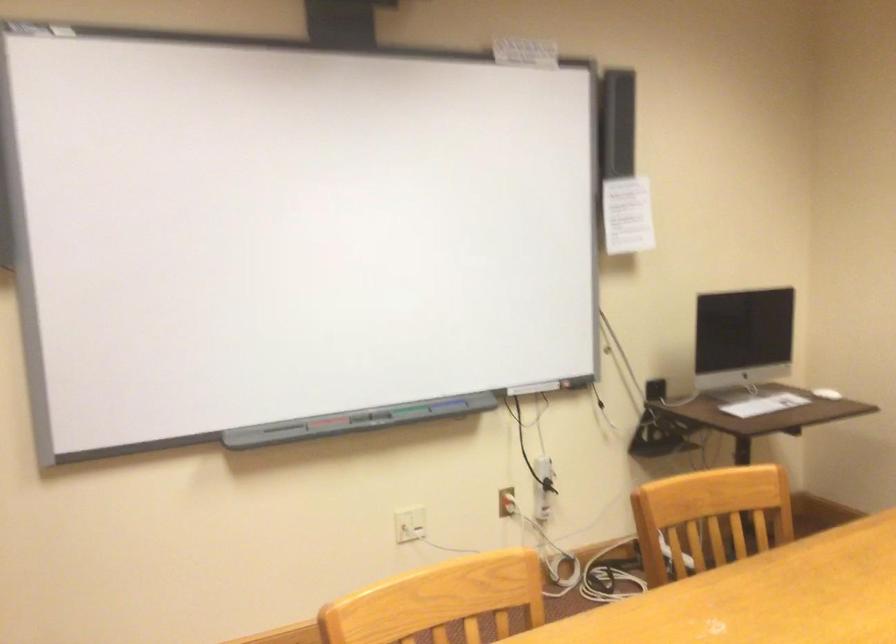
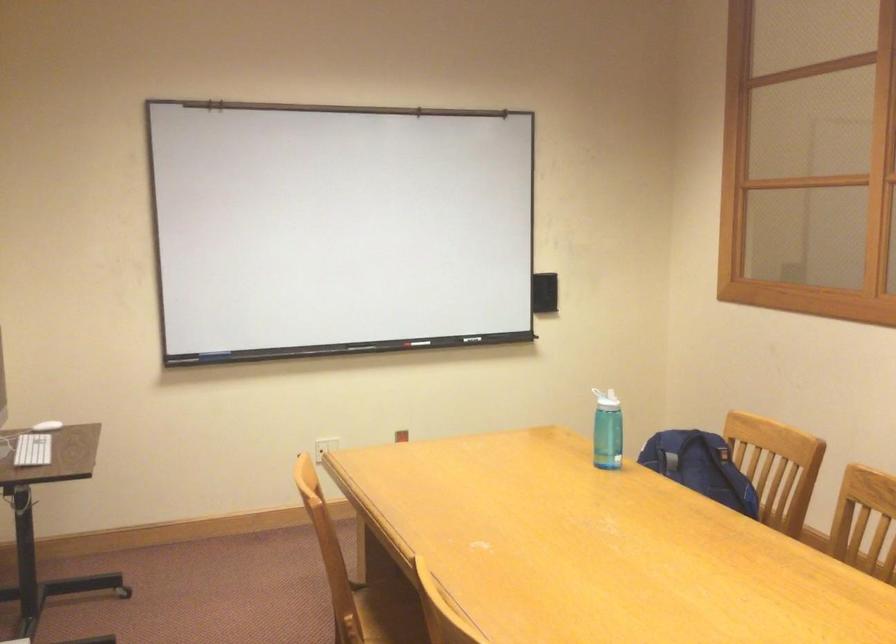
Locate, in the second image, the point that corresponds to point (773, 402) in the first image.

(32, 450)